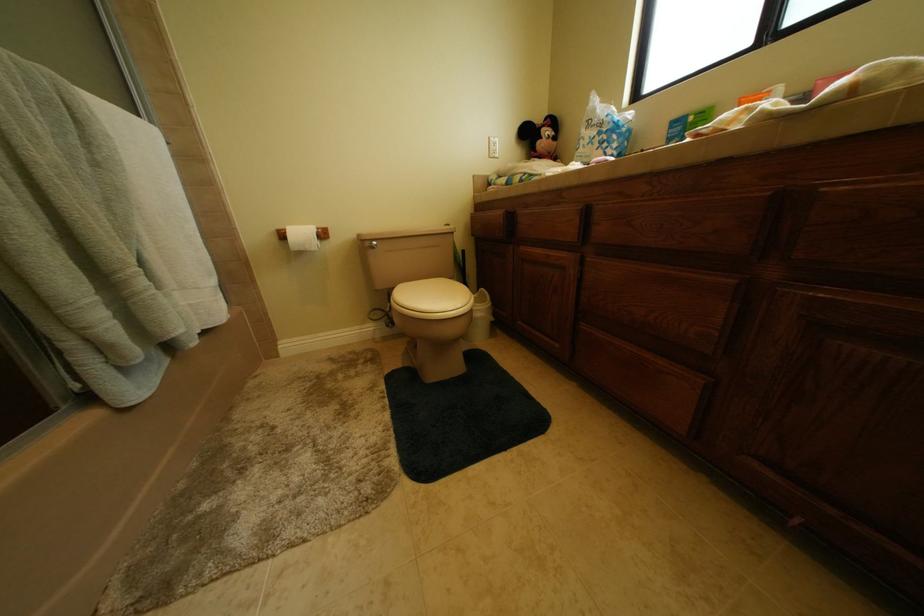
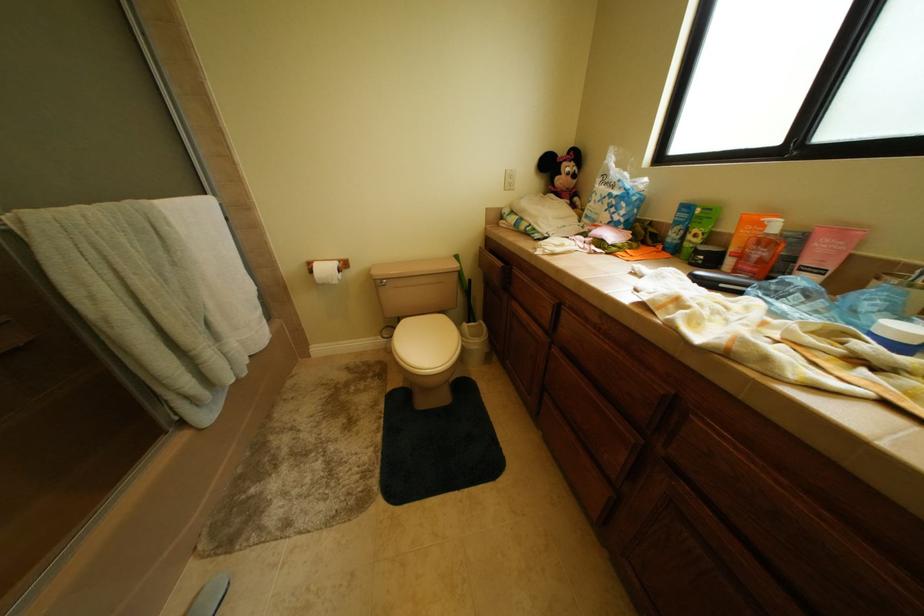
The images are taken continuously from a first-person perspective. In which direction are you moving?

The cameraman moved toward right, backward.